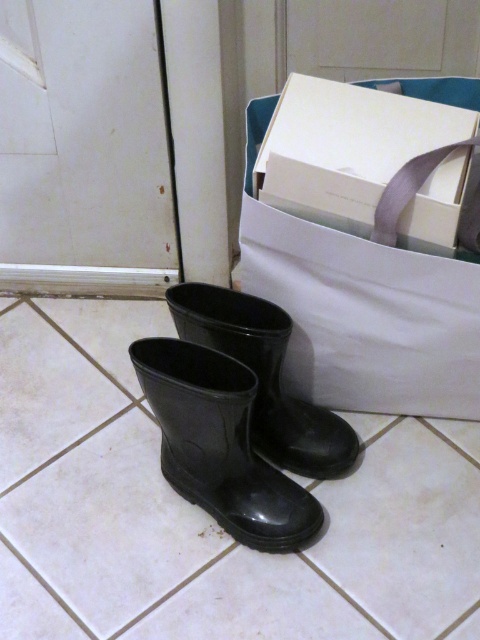
Can you confirm if white cardboard box at upper right is positioned to the left of glossy rubber boot at center?

No, white cardboard box at upper right is not to the left of glossy rubber boot at center.

Does point (399, 225) come farther from viewer compared to point (211, 337)?

That is False.

I want to click on white cardboard box at upper right, so click(347, 147).

Which of these two, black rubber boot at lower center or glossy rubber boot at center, stands shorter?

glossy rubber boot at center is shorter.

Which of these two, black rubber boot at lower center or glossy rubber boot at center, stands taller?

black rubber boot at lower center is taller.

Does point (288, 529) lie behind point (204, 324)?

That is False.

The height and width of the screenshot is (640, 480). I want to click on black rubber boot at lower center, so click(219, 445).

Between point (433, 129) and point (227, 410), which one is positioned in front?

Point (227, 410)

Between point (280, 182) and point (220, 368), which one is positioned behind?

Point (220, 368)

You are a GUI agent. You are given a task and a screenshot of the screen. Output one action in this format:
    pyautogui.click(x=<x>, y=<y>)
    Task: Click on the white cardboard box at upper right
    
    Given the screenshot: What is the action you would take?
    pyautogui.click(x=347, y=147)